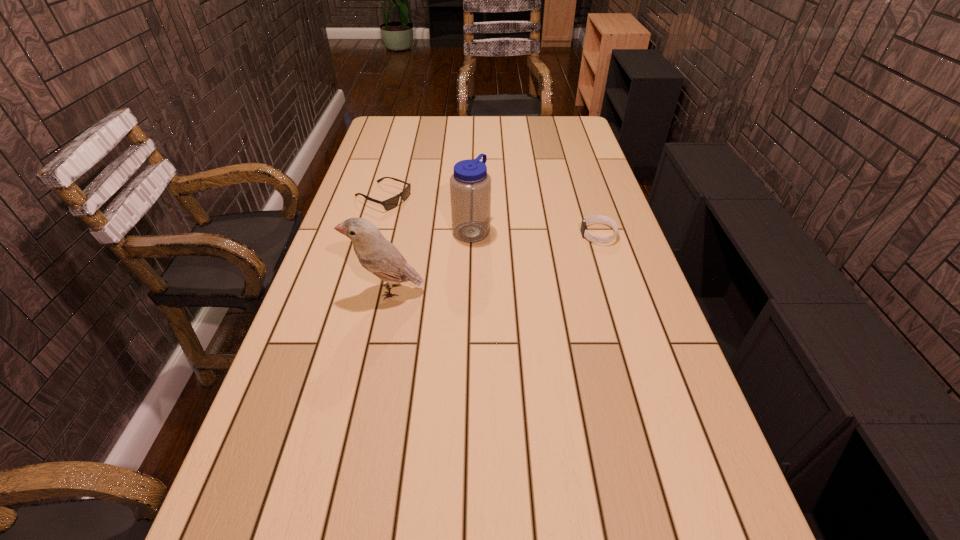
You are a GUI agent. You are given a task and a screenshot of the screen. Output one action in this format:
    pyautogui.click(x=<x>, y=<y>)
    Task: Click on the vacant space situated on the front-facing side of the farthest object
    
    Given the screenshot: What is the action you would take?
    pyautogui.click(x=505, y=248)

Locate an element on the screen. The height and width of the screenshot is (540, 960). free location located 0.100m on the front-facing side of the farthest object is located at coordinates (427, 216).

Identify the location of free location located with a carrying loop on the side of the third object from left to right. (539, 259).

Locate an element on the screen. free location located with a carrying loop on the side of the third object from left to right is located at coordinates (577, 274).

What are the coordinates of `vacant region located with a carrying loop on the side of the third object from left to right` in the screenshot? It's located at (583, 276).

This screenshot has height=540, width=960. What are the coordinates of `bird located in the left edge section of the desktop` in the screenshot? It's located at (375, 253).

The height and width of the screenshot is (540, 960). I want to click on sunglasses at the left edge, so click(389, 204).

Find the location of a particular element. The height and width of the screenshot is (540, 960). object situated at the right edge is located at coordinates (606, 220).

Identify the location of vacant area at the far edge. (473, 128).

Locate an element on the screen. The height and width of the screenshot is (540, 960). free region at the near edge is located at coordinates (547, 474).